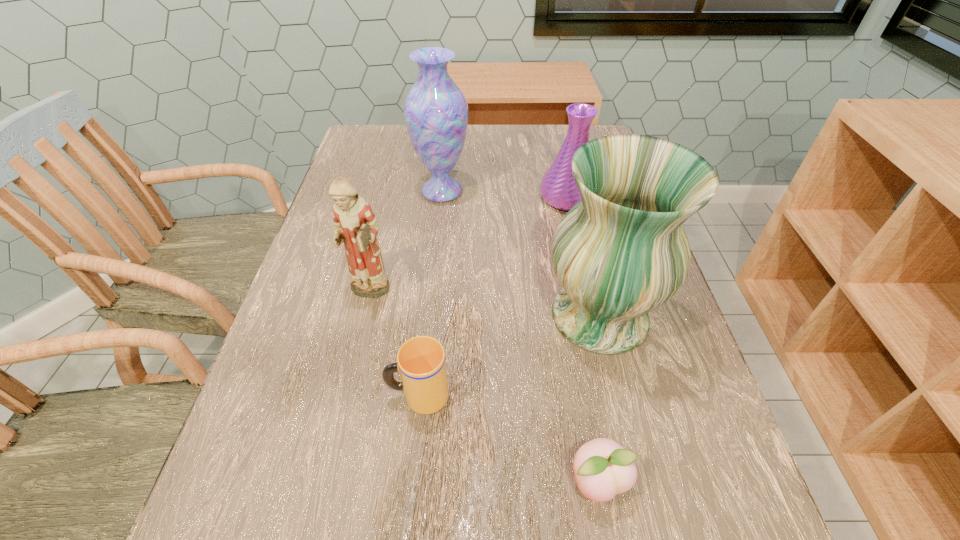
This screenshot has height=540, width=960. I want to click on the leftmost vase, so click(x=436, y=112).

Locate an element on the screen. the nearest vase is located at coordinates (621, 252).

This screenshot has height=540, width=960. Identify the location of the leftmost object. (355, 224).

Identify the location of the shortest vase. The height and width of the screenshot is (540, 960). (558, 188).

What are the coordinates of `cup` in the screenshot? It's located at (421, 363).

In order to click on the fifth farthest object in this screenshot , I will do `click(421, 363)`.

Where is `the shortest object`? Image resolution: width=960 pixels, height=540 pixels. the shortest object is located at coordinates (603, 468).

Where is `the nearest object`? This screenshot has width=960, height=540. the nearest object is located at coordinates click(x=603, y=468).

At what (x,y) coordinates should I click in order to perform the action: click on free location located 0.180m on the right of the leftmost vase. Please return your answer as a coordinate pair (x, y). Looking at the image, I should click on (538, 191).

Locate an element on the screen. This screenshot has width=960, height=540. vacant space located 0.230m on the front of the nearest vase is located at coordinates (644, 501).